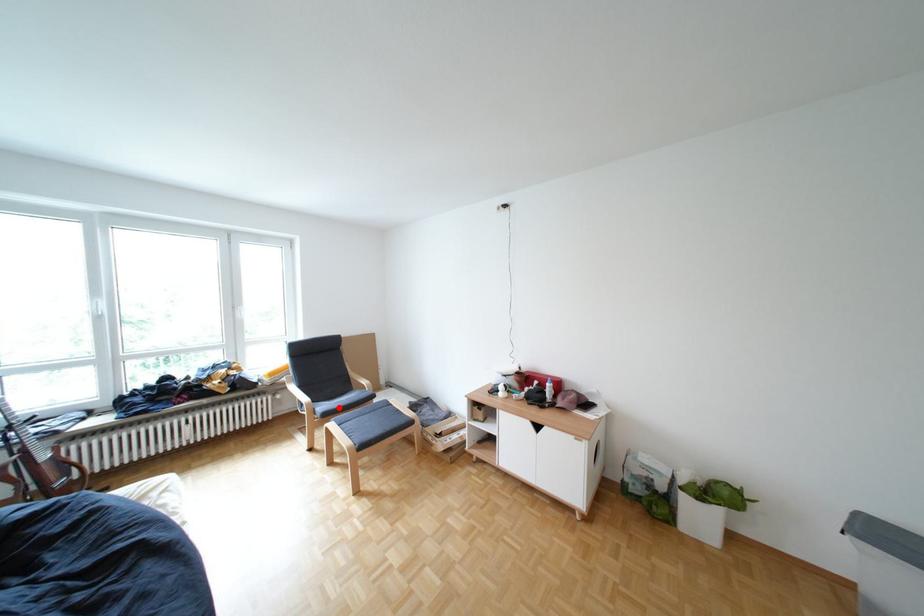
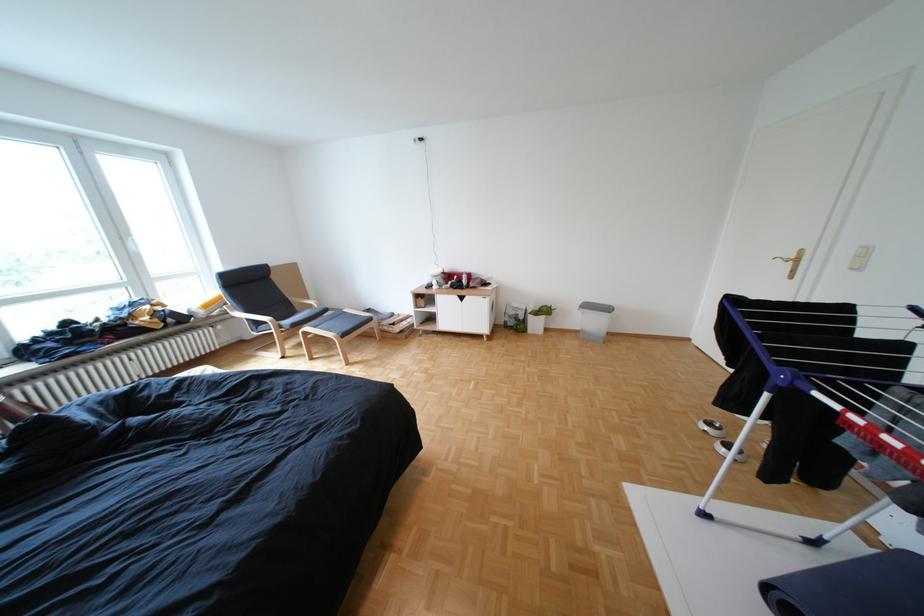
Question: I am providing you with two images of the same scene from different viewpoints. A red point is marked on the first image. At the location where the point appears in image 1, is it still visible in image 2?

Choices:
 (A) Yes
 (B) No

Answer: (A)